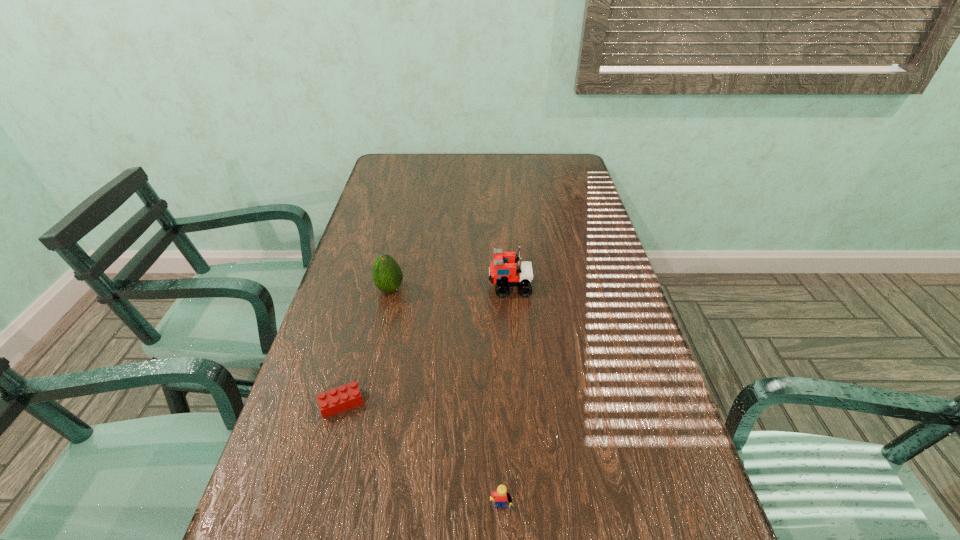
Where is `free space located on the right of the shortest object`? This screenshot has width=960, height=540. free space located on the right of the shortest object is located at coordinates (515, 403).

Locate an element on the screen. avocado situated at the left edge is located at coordinates (387, 275).

The image size is (960, 540). Identify the location of Lego present at the left edge. (334, 401).

This screenshot has height=540, width=960. In order to click on vacant space at the far edge of the desktop in this screenshot , I will do `click(472, 174)`.

At what (x,y) coordinates should I click in order to perform the action: click on free space at the left edge of the desktop. Please return your answer as a coordinate pair (x, y). Looking at the image, I should click on (303, 518).

You are a GUI agent. You are given a task and a screenshot of the screen. Output one action in this format:
    pyautogui.click(x=<x>, y=<y>)
    Task: Click on the vacant space at the right edge
    Image resolution: width=960 pixels, height=540 pixels.
    Given the screenshot: What is the action you would take?
    pyautogui.click(x=547, y=189)

At what (x,y) coordinates should I click in order to perform the action: click on free space at the far left corner of the desktop. Please return your answer as a coordinate pair (x, y). This screenshot has height=540, width=960. Looking at the image, I should click on (394, 165).

In order to click on free region at the far right corner in this screenshot , I will do `click(555, 177)`.

Locate an element on the screen. Image resolution: width=960 pixels, height=540 pixels. unoccupied area between the leftmost Lego and the farthest Lego is located at coordinates (426, 345).

Locate an element on the screen. The height and width of the screenshot is (540, 960). free space between the nearest object and the farthest Lego is located at coordinates (506, 400).